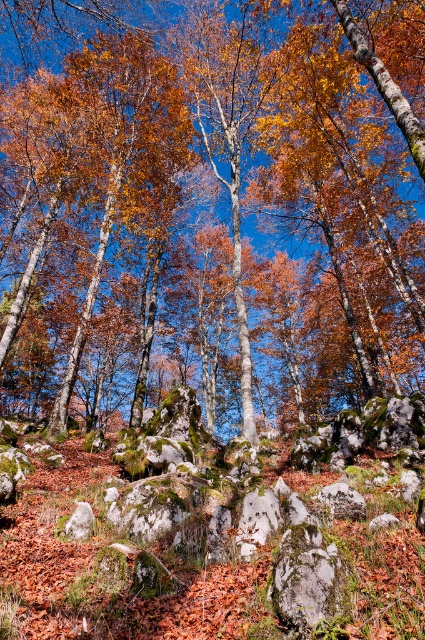
Between point (8, 321) and point (170, 596), which one is positioned in front?

Point (170, 596) is more forward.

Image resolution: width=425 pixels, height=640 pixels. In order to click on smooth stone boulder at center in this screenshot , I will do `click(209, 208)`.

Who is more distant from viewer, (357, 390) or (42, 572)?

Positioned behind is point (357, 390).

Locate an element on the screen. smooth stone boulder at center is located at coordinates (x=209, y=208).